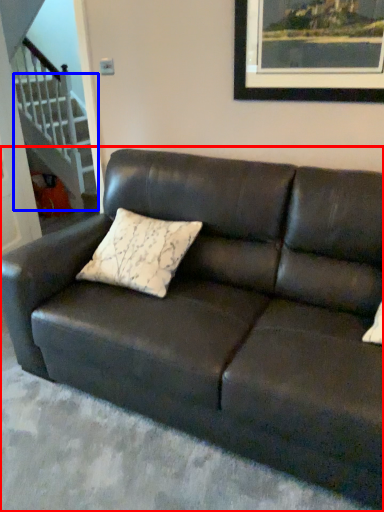
Question: Which point is closer to the camera, studio couch (highlighted by a red box) or stairwell (highlighted by a blue box)?

Choices:
 (A) studio couch
 (B) stairwell

Answer: (A)